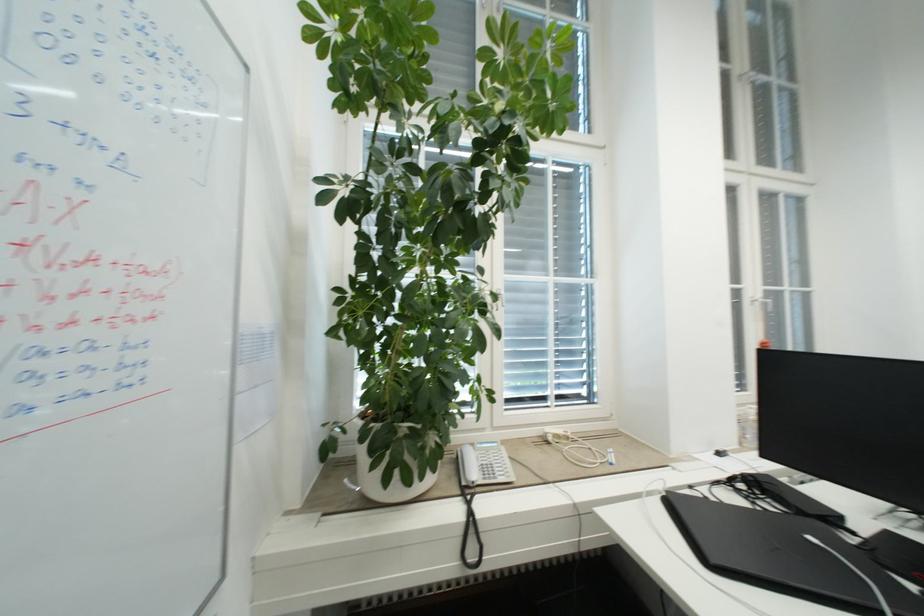
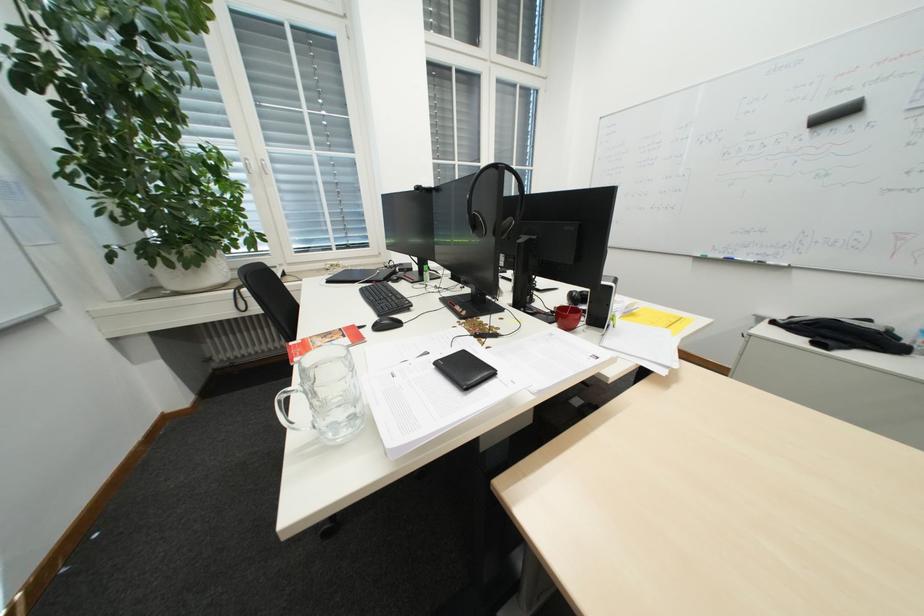
In a continuous first-person perspective shot, in which direction is the camera moving?

The movement direction of the cameraman is right, backward.